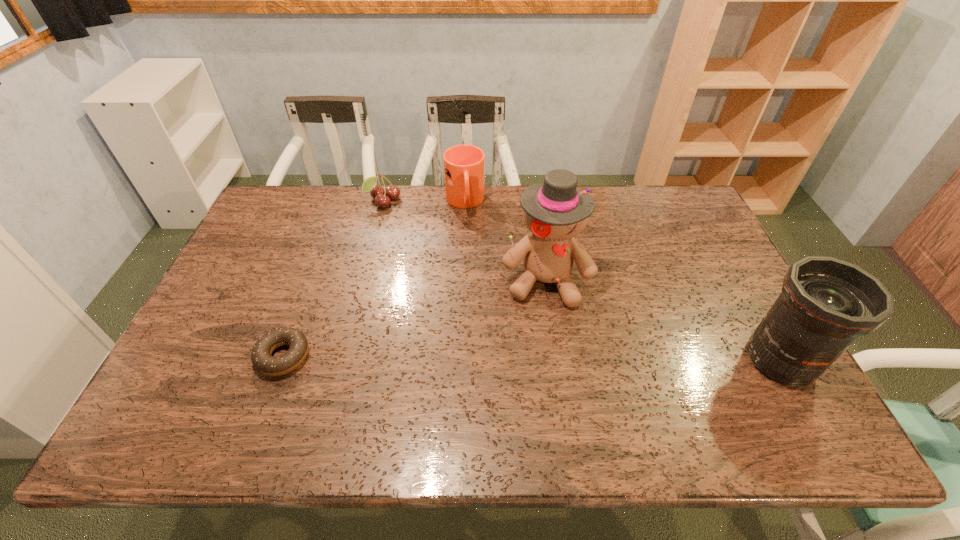
Find the location of a particular element. This screenshot has height=540, width=960. blank space at the near left corner of the desktop is located at coordinates (225, 369).

I want to click on empty space between the third shortest object and the shortest object, so click(374, 279).

Identify the location of vacant space that's between the telephoto lens and the rag_doll. The height and width of the screenshot is (540, 960). (662, 320).

I want to click on free spot between the doughnut and the fourth object from right to left, so click(333, 279).

Find the location of a particular element. vacant space in between the third object from right to left and the shortest object is located at coordinates (374, 279).

This screenshot has width=960, height=540. In order to click on free space that is in between the second object from right to left and the fourth shortest object in this screenshot , I will do `click(662, 320)`.

This screenshot has height=540, width=960. What are the coordinates of `free point between the tallest object and the third object from left to right` in the screenshot? It's located at (505, 241).

This screenshot has width=960, height=540. Find the location of `unoccupied position between the third nearest object and the cherry`. unoccupied position between the third nearest object and the cherry is located at coordinates (465, 241).

Find the location of `free space between the fourth object from right to left and the shortest object`. free space between the fourth object from right to left and the shortest object is located at coordinates (333, 279).

I want to click on unoccupied area between the second tallest object and the rag_doll, so (x=662, y=320).